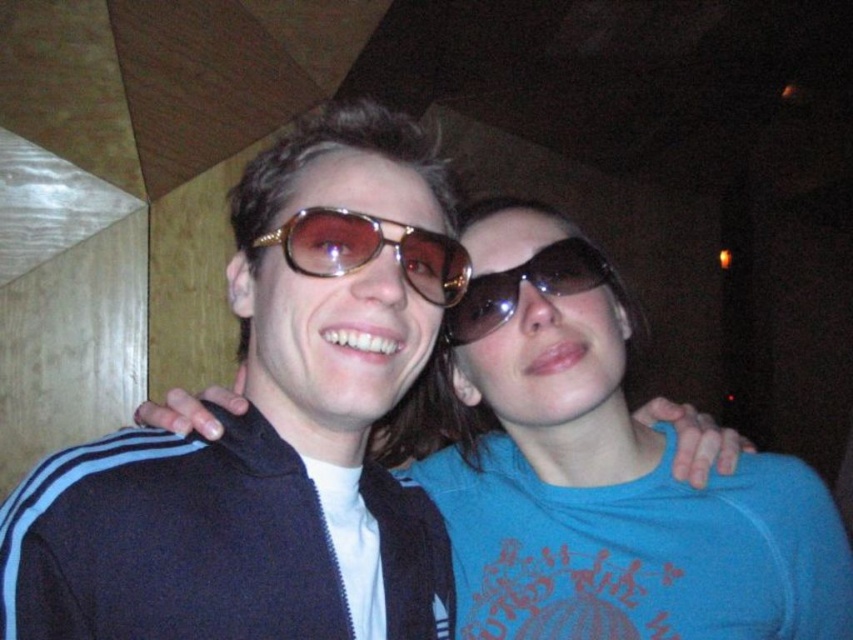
Between blue matte shirt at center and gold metallic sunglasses at center, which one has less height?

With less height is gold metallic sunglasses at center.

Is blue matte shirt at center bigger than gold metallic sunglasses at center?

Indeed, blue matte shirt at center has a larger size compared to gold metallic sunglasses at center.

Does point (741, 602) lie in front of point (462, 285)?

No.

The height and width of the screenshot is (640, 853). I want to click on blue matte shirt at center, so click(x=602, y=474).

Between point (463, 269) and point (613, 284), which one is positioned behind?

Point (613, 284)

At what (x,y) coordinates should I click in order to perform the action: click on gold metallic sunglasses at center. Please return your answer as a coordinate pair (x, y). The height and width of the screenshot is (640, 853). Looking at the image, I should click on (370, 250).

I want to click on blue matte shirt at center, so click(602, 474).

Describe the element at coordinates (602, 474) in the screenshot. I see `blue matte shirt at center` at that location.

This screenshot has height=640, width=853. What are the coordinates of `blue matte shirt at center` in the screenshot? It's located at (602, 474).